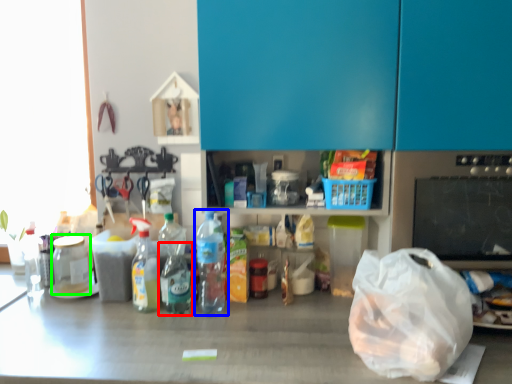
Question: Based on their relative distances, which object is farther from bottle (highlighted by a red box)? Choose from bottle (highlighted by a blue box) and bottle (highlighted by a green box).

Choices:
 (A) bottle
 (B) bottle

Answer: (B)